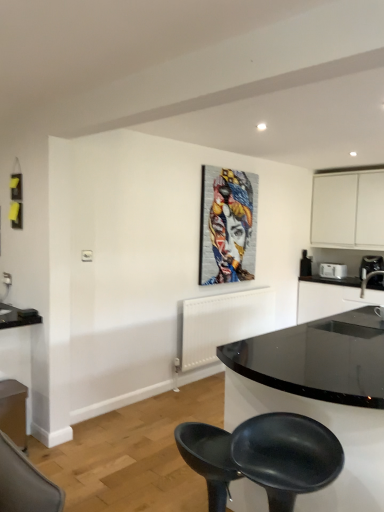
Describe the element at coordinates (208, 459) in the screenshot. The image size is (384, 512). I see `black matte stool at lower center, arranged as the first chair when viewed from the back` at that location.

Measure the distance between white plastic toaster at right, marked as the 1th appliance in a right-to-left arrangement, and camera.

white plastic toaster at right, marked as the 1th appliance in a right-to-left arrangement, and camera are 5.53 meters apart.

Where is `black matte stool at lower center, which is the second chair from back to front`? This screenshot has height=512, width=384. black matte stool at lower center, which is the second chair from back to front is located at coordinates (286, 456).

Measure the distance between black plastic toaster at upper right, placed as the second appliance when sorted from right to left, and camera.

black plastic toaster at upper right, placed as the second appliance when sorted from right to left, is 5.57 meters away from camera.

The width and height of the screenshot is (384, 512). In order to click on black matte stool at lower center, arranged as the first chair when viewed from the back in this screenshot , I will do `click(208, 459)`.

Is black plastic coffee machine at right aimed at black matte stool at lower center, which is the second chair from back to front?

Yes, black plastic coffee machine at right is oriented towards black matte stool at lower center, which is the second chair from back to front.

Consider the image. How different are the orientations of black plastic coffee machine at right and black matte stool at lower center, which is the first chair from front to back, in degrees?

The angular difference between black plastic coffee machine at right and black matte stool at lower center, which is the first chair from front to back, is 25.1 degrees.

Is black plastic coffee machine at right at the right side of black matte stool at lower center, which is the second chair from back to front?

Yes, black plastic coffee machine at right is to the right of black matte stool at lower center, which is the second chair from back to front.

I want to click on the 1st chair below the black plastic coffee machine at right (from the image's perspective), so click(x=286, y=456).

From a real-world perspective, is metallic textured painting at center physically located above or below black plastic toaster at upper right, the first appliance viewed from the left?

metallic textured painting at center is above black plastic toaster at upper right, the first appliance viewed from the left.

Can you confirm if metallic textured painting at center is shorter than black plastic toaster at upper right, the first appliance viewed from the left?

No, metallic textured painting at center is not shorter than black plastic toaster at upper right, the first appliance viewed from the left.

What's the angular difference between metallic textured painting at center and black plastic toaster at upper right, the first appliance viewed from the left,'s facing directions?

They differ by 0.623 degrees in their facing directions.

Considering the sizes of black plastic toaster at upper right, the first appliance viewed from the left, and metallic textured painting at center in the image, is black plastic toaster at upper right, the first appliance viewed from the left, bigger or smaller than metallic textured painting at center?

In the image, black plastic toaster at upper right, the first appliance viewed from the left, appears to be smaller than metallic textured painting at center.

Can you confirm if black plastic toaster at upper right, placed as the second appliance when sorted from right to left, is positioned to the left of metallic textured painting at center?

No, black plastic toaster at upper right, placed as the second appliance when sorted from right to left, is not to the left of metallic textured painting at center.

Does black plastic toaster at upper right, the first appliance viewed from the left, lie behind metallic textured painting at center?

Yes.

In terms of height, does matte white cabinet at lower left, which is the first cabinetry from bottom to top, look taller or shorter compared to black matte stool at lower center, arranged as the first chair when viewed from the back?

Considering their sizes, matte white cabinet at lower left, which is the first cabinetry from bottom to top, has less height than black matte stool at lower center, arranged as the first chair when viewed from the back.

From a real-world perspective, who is located higher, matte white cabinet at lower left, the 2th cabinetry when ordered from top to bottom, or black matte stool at lower center, positioned as the 2th chair in front-to-back order?

black matte stool at lower center, positioned as the 2th chair in front-to-back order.

Can you confirm if matte white cabinet at lower left, which is the first cabinetry from bottom to top, is bigger than black matte stool at lower center, positioned as the 2th chair in front-to-back order?

Incorrect, matte white cabinet at lower left, which is the first cabinetry from bottom to top, is not larger than black matte stool at lower center, positioned as the 2th chair in front-to-back order.

Looking at their sizes, would you say matte white cabinet at lower left, marked as the 2th cabinetry in a back-to-front arrangement, is wider or thinner than black matte stool at lower center, positioned as the 2th chair in front-to-back order?

Clearly, matte white cabinet at lower left, marked as the 2th cabinetry in a back-to-front arrangement, has less width compared to black matte stool at lower center, positioned as the 2th chair in front-to-back order.

Which is correct: black plastic coffee machine at right is inside black matte stool at lower center, positioned as the 2th chair in front-to-back order, or outside of it?

black plastic coffee machine at right cannot be found inside black matte stool at lower center, positioned as the 2th chair in front-to-back order.

Could you measure the distance between black plastic coffee machine at right and black matte stool at lower center, arranged as the first chair when viewed from the back?

black plastic coffee machine at right is 4.06 meters from black matte stool at lower center, arranged as the first chair when viewed from the back.

Between black plastic coffee machine at right and black matte stool at lower center, positioned as the 2th chair in front-to-back order, which one has smaller width?

black plastic coffee machine at right is thinner.

Is black glossy sink at right facing away from black matte stool at lower center, which is the first chair from front to back?

No, black matte stool at lower center, which is the first chair from front to back, is not at the back of black glossy sink at right.

From the image's perspective, is black glossy sink at right located above black matte stool at lower center, which is the second chair from back to front?

Correct, black glossy sink at right appears higher than black matte stool at lower center, which is the second chair from back to front, in the image.

The height and width of the screenshot is (512, 384). Find the location of `the 1st chair below when counting from the black glossy sink at right (from the image's perspective)`. the 1st chair below when counting from the black glossy sink at right (from the image's perspective) is located at coordinates (286, 456).

Is black glossy sink at right looking in the opposite direction of white matte cabinet at upper right, acting as the 1th cabinetry starting from the back?

No, black glossy sink at right's orientation is not away from white matte cabinet at upper right, acting as the 1th cabinetry starting from the back.

From a real-world perspective, between black glossy sink at right and white matte cabinet at upper right, acting as the 1th cabinetry starting from the back, who is vertically lower?

From a 3D spatial view, black glossy sink at right is below.

Does point (364, 270) come closer to viewer compared to point (363, 173)?

No.

Does black glossy sink at right have a lesser height compared to white matte cabinet at upper right, acting as the 1th cabinetry starting from the back?

Correct, black glossy sink at right is not as tall as white matte cabinet at upper right, acting as the 1th cabinetry starting from the back.

Locate an element on the screen. The height and width of the screenshot is (512, 384). chair that is the 1st object to the left of the black plastic coffee machine at right, starting at the anchor is located at coordinates (286, 456).

You are a GUI agent. You are given a task and a screenshot of the screen. Output one action in this format:
    pyautogui.click(x=<x>, y=<y>)
    Task: Click on the appliance that is the 1st object to the right of the metallic textured painting at center, starting at the anchor
    Image resolution: width=384 pixels, height=512 pixels.
    Given the screenshot: What is the action you would take?
    pyautogui.click(x=305, y=265)

From the image, which object appears to be nearer to black plastic coffee machine at right, white matte cabinet at upper right, the first cabinetry in the right-to-left sequence, or metallic textured painting at center?

white matte cabinet at upper right, the first cabinetry in the right-to-left sequence, lies closer to black plastic coffee machine at right than the other object.

Looking at the image, which one is located closer to black plastic coffee machine at right, black glossy countertop at right or black matte stool at lower center, arranged as the first chair when viewed from the back?

black glossy countertop at right lies closer to black plastic coffee machine at right than the other object.

Looking at the image, which one is located closer to black glossy countertop at right, black glossy sink at right or black plastic toaster at upper right, the first appliance viewed from the left?

Among the two, black glossy sink at right is located nearer to black glossy countertop at right.

When comparing their distances from black glossy sink at right, does black plastic coffee machine at right or white plastic toaster at right, arranged as the 2th appliance when viewed from the left, seem further?

white plastic toaster at right, arranged as the 2th appliance when viewed from the left, lies further to black glossy sink at right than the other object.

Looking at the image, which one is located closer to black plastic coffee machine at right, black glossy sink at right or matte white cabinet at lower left, the 2th cabinetry when ordered from top to bottom?

black glossy sink at right is positioned closer to the anchor black plastic coffee machine at right.

Considering their positions, is black glossy sink at right positioned further to white plastic toaster at right, arranged as the 2th appliance when viewed from the left, than white matte cabinet at upper right, the first cabinetry in the right-to-left sequence?

white matte cabinet at upper right, the first cabinetry in the right-to-left sequence, is positioned further to the anchor white plastic toaster at right, arranged as the 2th appliance when viewed from the left.

When comparing their distances from black plastic coffee machine at right, does black matte stool at lower center, arranged as the first chair when viewed from the back, or black plastic toaster at upper right, the first appliance viewed from the left, seem further?

Among the two, black matte stool at lower center, arranged as the first chair when viewed from the back, is located further to black plastic coffee machine at right.

Based on their spatial positions, is black glossy countertop at right or black glossy sink at right closer to black plastic coffee machine at right?

black glossy sink at right is positioned closer to the anchor black plastic coffee machine at right.

Locate an element on the screen. picture frame positioned between black matte stool at lower center, which is the first chair from front to back, and white plastic toaster at right, arranged as the 2th appliance when viewed from the left, from near to far is located at coordinates (227, 225).

Where is `picture frame between matte white cabinet at lower left, arranged as the first cabinetry when viewed from the front, and black glossy sink at right from left to right`? This screenshot has width=384, height=512. picture frame between matte white cabinet at lower left, arranged as the first cabinetry when viewed from the front, and black glossy sink at right from left to right is located at coordinates [227, 225].

You are a GUI agent. You are given a task and a screenshot of the screen. Output one action in this format:
    pyautogui.click(x=<x>, y=<y>)
    Task: Click on the picture frame between black matte stool at lower center, positioned as the 2th chair in front-to-back order, and black glossy countertop at right from front to back
    
    Given the screenshot: What is the action you would take?
    pyautogui.click(x=227, y=225)

The width and height of the screenshot is (384, 512). What are the coordinates of `cabinetry positioned between black matte stool at lower center, positioned as the 2th chair in front-to-back order, and metallic textured painting at center from near to far` in the screenshot? It's located at (13, 411).